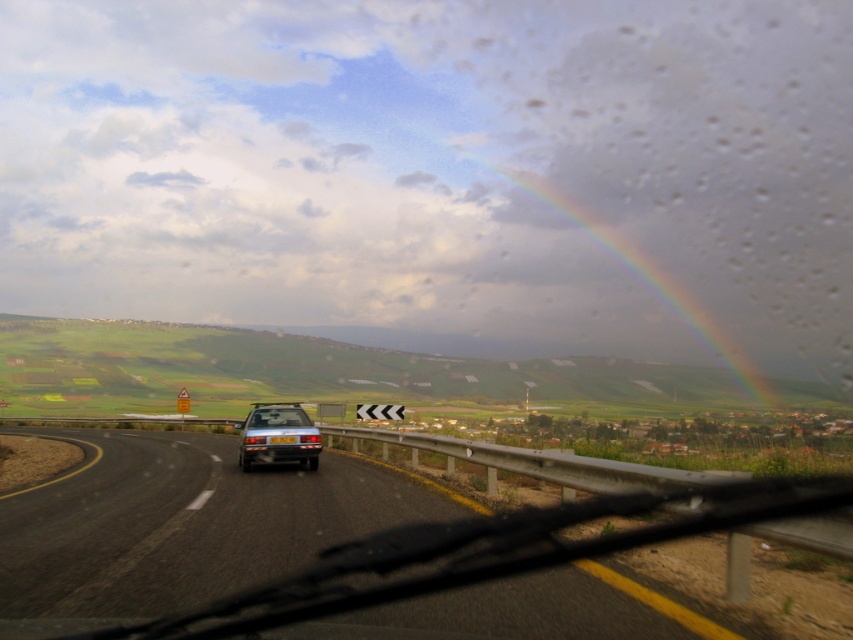
You are a passenger in the car and notice both the rainbow at upper center and the clear glass car window at center. Which object is wider from your viewpoint?

The rainbow at upper center might be wider than clear glass car window at center according to the description.

You are a passenger in the car and looking out the windshield. You notice a rainbow at upper center. Where exactly is the rainbow located in relation to the road and the guardrail?

The rainbow at upper center is located at coordinates point (x=630, y=296), which is above the road and to the right side near the guardrail.

You are driving a car and want to know if the metallic silver hatchback at center is visible through the clear glass car window at center. Can you see it?

The metallic silver hatchback at center and clear glass car window at center are 11.96 inches apart, so yes, the metallic silver hatchback at center is visible through the clear glass car window at center because they are close enough for visibility.